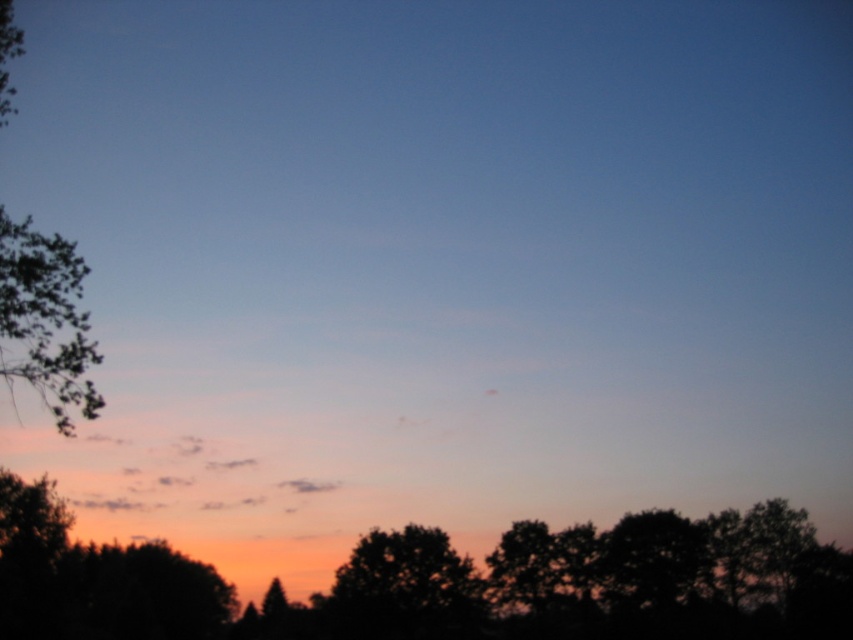
Question: Does green leafy tree at left lie behind silhouette tree at center?

Choices:
 (A) no
 (B) yes

Answer: (A)

Question: Which point is closer to the camera taking this photo?

Choices:
 (A) (10, 288)
 (B) (624, 518)

Answer: (A)

Question: Which point is farther from the camera taking this photo?

Choices:
 (A) (80, 289)
 (B) (344, 618)

Answer: (B)

Question: Can you confirm if green leafy tree at left is positioned to the left of silhouette tree at center?

Choices:
 (A) yes
 (B) no

Answer: (A)

Question: Among these points, which one is farthest from the camera?

Choices:
 (A) (468, 573)
 (B) (32, 268)
 (C) (322, 596)

Answer: (C)

Question: Is the position of silhouette tree at lower center more distant than that of silhouette tree at center?

Choices:
 (A) no
 (B) yes

Answer: (A)